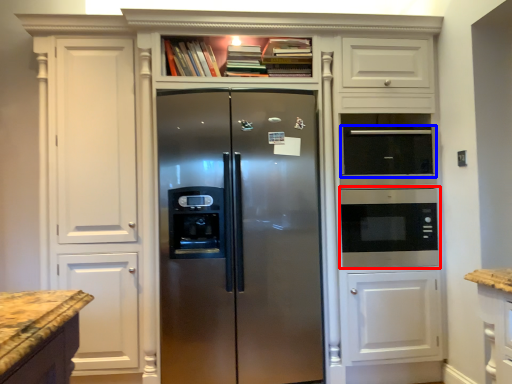
Question: Which object appears closest to the camera in this image, microwave oven (highlighted by a red box) or appliance (highlighted by a blue box)?

Choices:
 (A) microwave oven
 (B) appliance

Answer: (B)